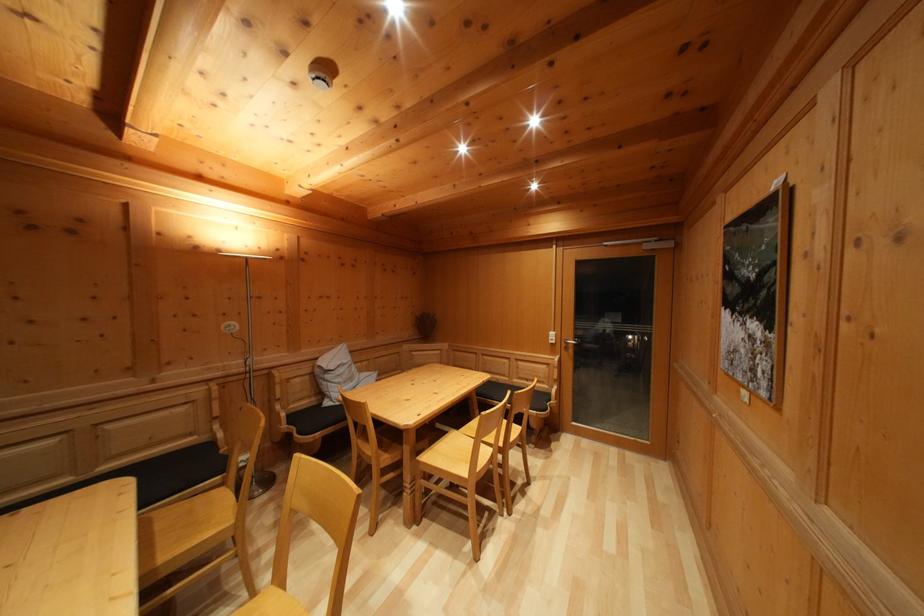
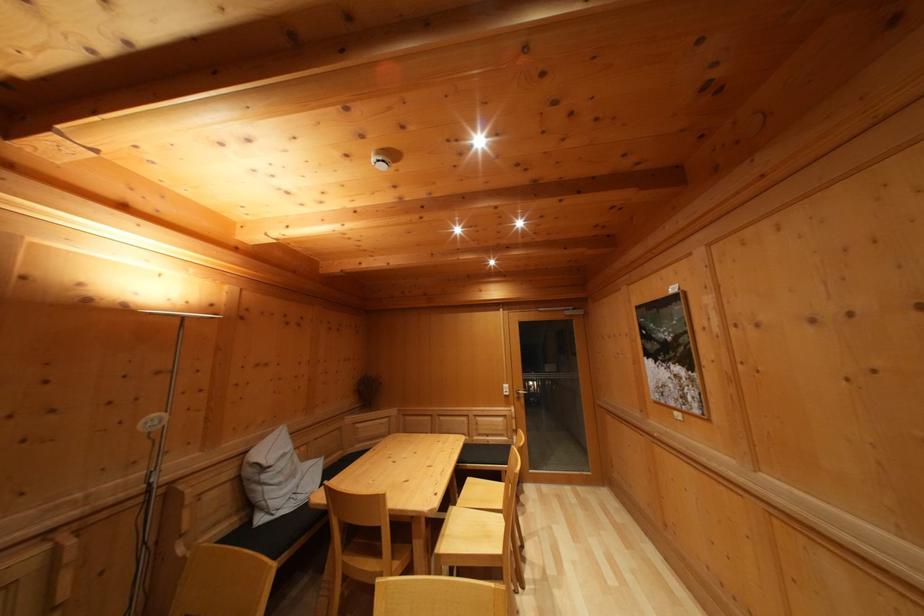
Question: Which direction would the cameraman need to move to produce the second image? Reply with the corresponding letter.

Choices:
 (A) Left
 (B) Right
 (C) Forward
 (D) Backward

Answer: (A)